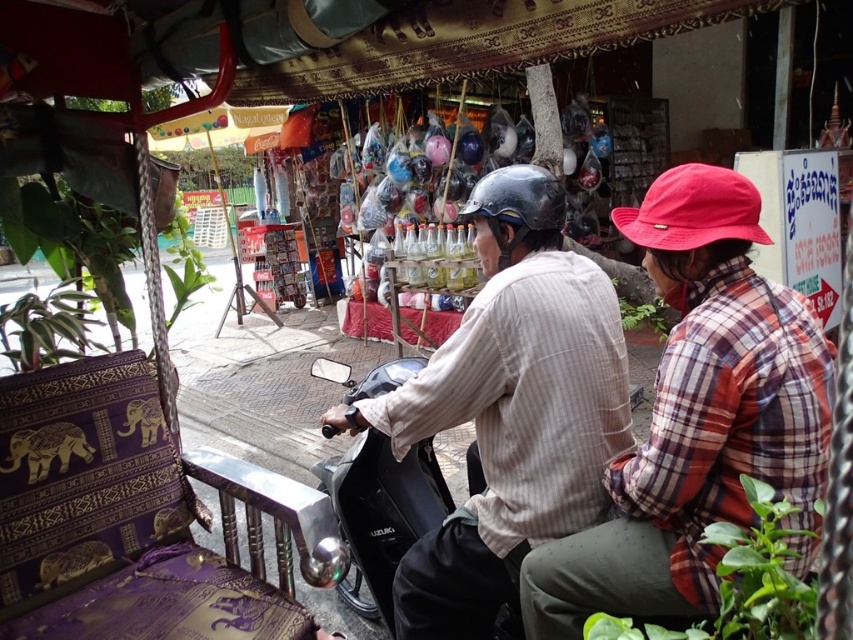
Question: Does plaid fabric shirt at center appear over striped cotton shirt at center?

Choices:
 (A) no
 (B) yes

Answer: (B)

Question: Is plaid fabric shirt at center to the right of striped cotton shirt at center from the viewer's perspective?

Choices:
 (A) yes
 (B) no

Answer: (A)

Question: Which point is closer to the camera?

Choices:
 (A) plaid fabric shirt at center
 (B) striped cotton shirt at center

Answer: (A)

Question: Which of the following is the farthest from the observer?

Choices:
 (A) [x=688, y=516]
 (B) [x=589, y=488]

Answer: (B)

Question: Is plaid fabric shirt at center bigger than striped cotton shirt at center?

Choices:
 (A) yes
 (B) no

Answer: (B)